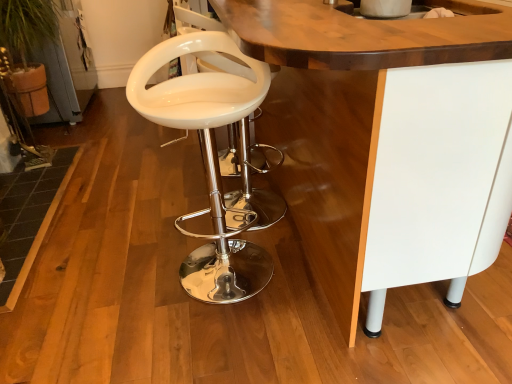
Identify the location of white glossy bar stool at center. (208, 159).

What do you see at coordinates (410, 132) in the screenshot? This screenshot has width=512, height=384. I see `white glossy table at center` at bounding box center [410, 132].

Find the location of a particular element. This screenshot has width=512, height=384. white glossy sink at upper center is located at coordinates (384, 18).

The image size is (512, 384). I want to click on white glossy bar stool at center, so click(208, 159).

Which is in front, white glossy sink at upper center or white glossy table at center?

white glossy table at center is closer to the camera.

Choose the correct answer: Is white glossy sink at upper center inside white glossy table at center or outside it?

white glossy sink at upper center fits inside white glossy table at center.

Is white glossy sink at upper center touching white glossy table at center?

white glossy sink at upper center and white glossy table at center are clearly separated.

How different are the orientations of white glossy sink at upper center and white glossy table at center in degrees?

The facing directions of white glossy sink at upper center and white glossy table at center are 176 degrees apart.

Considering the positions of objects white glossy table at center and white glossy sink at upper center in the image provided, who is more to the right, white glossy table at center or white glossy sink at upper center?

white glossy sink at upper center is more to the right.

Based on the photo, how many degrees apart are the facing directions of white glossy table at center and white glossy sink at upper center?

The facing directions of white glossy table at center and white glossy sink at upper center are 176 degrees apart.

In the scene shown: Is white glossy table at center next to white glossy sink at upper center?

white glossy table at center and white glossy sink at upper center are clearly separated.

From the image's perspective, is white glossy table at center above or below white glossy sink at upper center?

Based on their image positions, white glossy table at center is located beneath white glossy sink at upper center.

Between white glossy bar stool at center and white glossy table at center, which one appears on the right side from the viewer's perspective?

Positioned to the right is white glossy table at center.

Is white glossy bar stool at center taller than white glossy table at center?

Incorrect, the height of white glossy bar stool at center is not larger of that of white glossy table at center.

From a real-world perspective, is white glossy bar stool at center on top of white glossy table at center?

Incorrect, from a real-world perspective, white glossy bar stool at center is lower than white glossy table at center.

Locate an element on the screen. chair on the left of white glossy table at center is located at coordinates (208, 159).

Would you consider white glossy table at center to be distant from white glossy bar stool at center?

white glossy table at center is actually quite close to white glossy bar stool at center.

Considering the sizes of white glossy table at center and white glossy bar stool at center in the image, is white glossy table at center taller or shorter than white glossy bar stool at center?

Considering their sizes, white glossy table at center has more height than white glossy bar stool at center.

Considering their positions, is white glossy table at center located in front of or behind white glossy bar stool at center?

Visually, white glossy table at center is located in front of white glossy bar stool at center.

Is point (338, 45) closer to viewer compared to point (165, 42)?

Yes.

From the image's perspective, is white glossy bar stool at center located beneath white glossy sink at upper center?

Correct, white glossy bar stool at center appears lower than white glossy sink at upper center in the image.

Are white glossy bar stool at center and white glossy sink at upper center far apart?

No, there isn't a large distance between white glossy bar stool at center and white glossy sink at upper center.

From a real-world perspective, is white glossy bar stool at center over white glossy sink at upper center?

Actually, white glossy bar stool at center is physically below white glossy sink at upper center in the real world.

Can you confirm if white glossy bar stool at center is positioned to the right of white glossy sink at upper center?

No.

Which is behind, point (416, 16) or point (193, 47)?

The point (193, 47) is farther.

Considering the sizes of objects white glossy sink at upper center and white glossy bar stool at center in the image provided, who is taller, white glossy sink at upper center or white glossy bar stool at center?

white glossy bar stool at center.

From a real-world perspective, is white glossy sink at upper center positioned above or below white glossy bar stool at center?

In terms of real-world spatial position, white glossy sink at upper center is above white glossy bar stool at center.

You are a GUI agent. You are given a task and a screenshot of the screen. Output one action in this format:
    pyautogui.click(x=<x>, y=<y>)
    Task: Click on the sink behind the white glossy table at center
    This screenshot has width=512, height=384.
    Given the screenshot: What is the action you would take?
    pyautogui.click(x=384, y=18)

The width and height of the screenshot is (512, 384). Identify the location of sink that is on the right side of white glossy table at center. (384, 18).

Based on their spatial positions, is white glossy bar stool at center or white glossy table at center closer to white glossy sink at upper center?

Among the two, white glossy table at center is located nearer to white glossy sink at upper center.

Looking at the image, which one is located further to white glossy table at center, white glossy sink at upper center or white glossy bar stool at center?

white glossy bar stool at center is further to white glossy table at center.

Considering their positions, is white glossy bar stool at center positioned further to white glossy table at center than white glossy sink at upper center?

white glossy bar stool at center lies further to white glossy table at center than the other object.

Estimate the real-world distances between objects in this image. Which object is further from white glossy sink at upper center, white glossy table at center or white glossy bar stool at center?

white glossy bar stool at center.

When comparing their distances from white glossy bar stool at center, does white glossy sink at upper center or white glossy table at center seem further?

white glossy sink at upper center lies further to white glossy bar stool at center than the other object.

Considering their positions, is white glossy table at center positioned further to white glossy bar stool at center than white glossy sink at upper center?

The object further to white glossy bar stool at center is white glossy sink at upper center.

The image size is (512, 384). What are the coordinates of `table between white glossy bar stool at center and white glossy sink at upper center` in the screenshot? It's located at (410, 132).